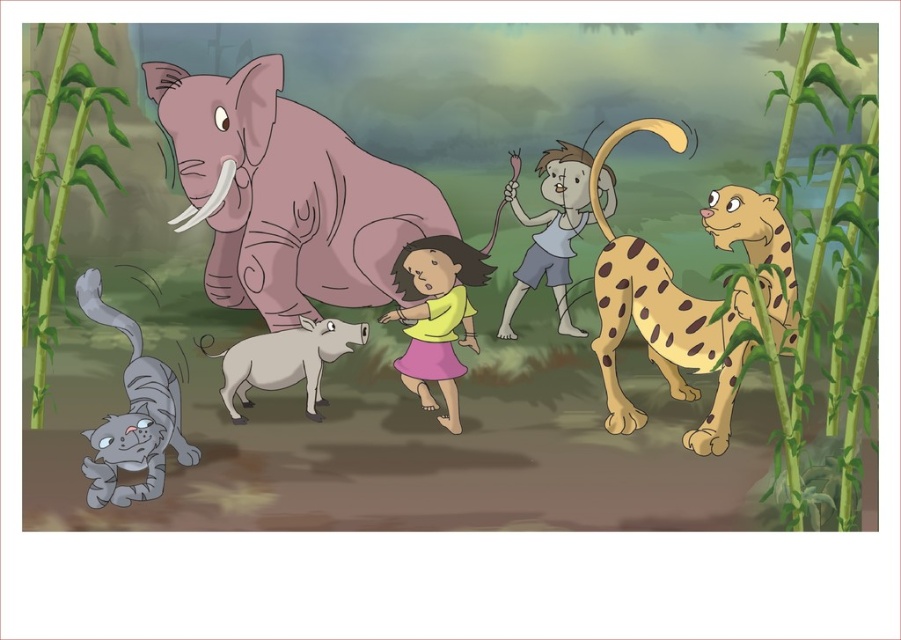
In the jungle scene with the gray cat and white boar, there is a pink matte elephant at center and a white matte goat at center. Which of these two animals is positioned higher in the image?

The pink matte elephant at center is positioned higher than the white matte goat at center.

What is the location of the point with coordinates (287,195) in the image?

The point with coordinates (287,195) is on the pink matte elephant at center.

Where is the pink matte elephant at center located in the image?

The pink matte elephant at center is located at point coordinates of 0.306 on the x axis and 0.320 on the y axis.